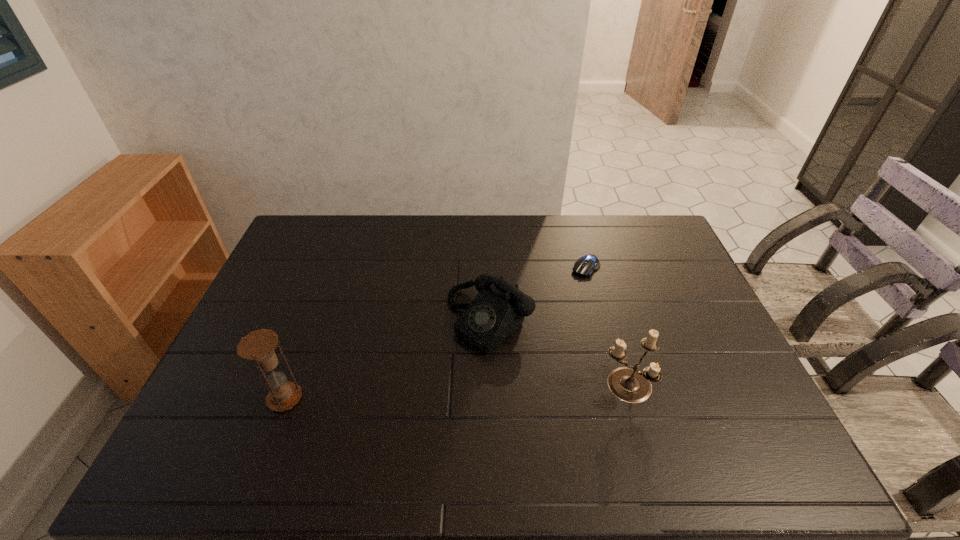
Locate an element on the screen. vacant point located 0.250m on the button side of the computer mouse is located at coordinates (539, 319).

Where is `vacant space situated on the button side of the computer mouse`? This screenshot has width=960, height=540. vacant space situated on the button side of the computer mouse is located at coordinates (549, 308).

Locate an element on the screen. The width and height of the screenshot is (960, 540). vacant space located on the dial of the third tallest object is located at coordinates (403, 400).

Identify the location of free location located 0.310m on the dial of the third tallest object. (375, 424).

You are a GUI agent. You are given a task and a screenshot of the screen. Output one action in this format:
    pyautogui.click(x=<x>, y=<y>)
    Task: Click on the vacant space located 0.090m on the dial of the third tallest object
    This screenshot has width=960, height=540.
    Given the screenshot: What is the action you would take?
    pyautogui.click(x=439, y=367)

Image resolution: width=960 pixels, height=540 pixels. I want to click on hourglass that is at the near edge, so click(259, 345).

Identify the location of candle holder located in the near edge section of the desktop. The image size is (960, 540). (627, 383).

Where is `object located in the left edge section of the desktop`? This screenshot has width=960, height=540. object located in the left edge section of the desktop is located at coordinates (259, 345).

You are a GUI agent. You are given a task and a screenshot of the screen. Output one action in this format:
    pyautogui.click(x=<x>, y=<y>)
    Task: Click on the object situated at the near left corner
    The image size is (960, 540).
    Given the screenshot: What is the action you would take?
    pyautogui.click(x=259, y=345)

I want to click on vacant point at the far edge, so click(505, 224).